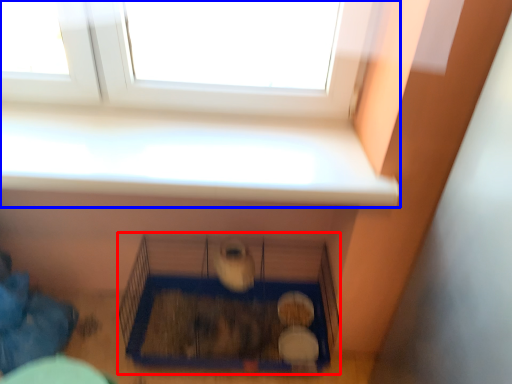
Question: Which object appears farthest to the camera in this image, bird cage (highlighted by a red box) or window (highlighted by a blue box)?

Choices:
 (A) bird cage
 (B) window

Answer: (A)